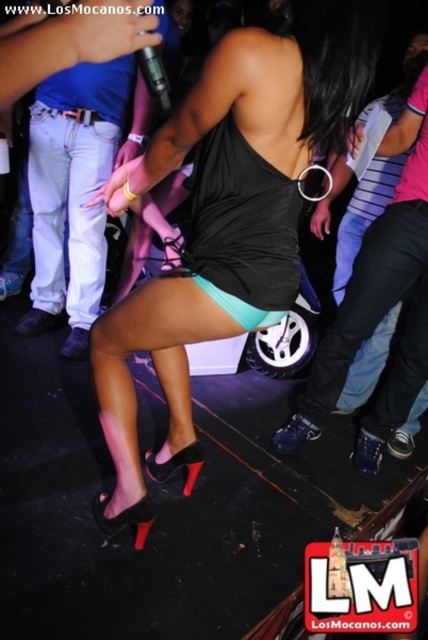
Who is more forward, (296, 16) or (58, 170)?

Positioned in front is point (296, 16).

You are a GUI agent. You are given a task and a screenshot of the screen. Output one action in this format:
    pyautogui.click(x=<x>, y=<y>)
    Task: Click on the matte black dress at center
    This screenshot has height=640, width=428.
    Given the screenshot: What is the action you would take?
    pyautogui.click(x=226, y=214)

Who is more forward, (404, 294) or (50, 208)?

Point (404, 294) is in front.

Image resolution: width=428 pixels, height=640 pixels. What do you see at coordinates (379, 321) in the screenshot? I see `black leather pants at lower right` at bounding box center [379, 321].

This screenshot has width=428, height=640. What do you see at coordinates (379, 321) in the screenshot?
I see `black leather pants at lower right` at bounding box center [379, 321].

The height and width of the screenshot is (640, 428). I want to click on black leather pants at lower right, so click(379, 321).

Is point (220, 307) positioned behind point (372, 326)?

No.

Can you confirm if matte black dress at center is smaller than black leather pants at lower right?

Incorrect, matte black dress at center is not smaller in size than black leather pants at lower right.

Locate an element on the screen. The image size is (428, 640). matte black dress at center is located at coordinates (226, 214).